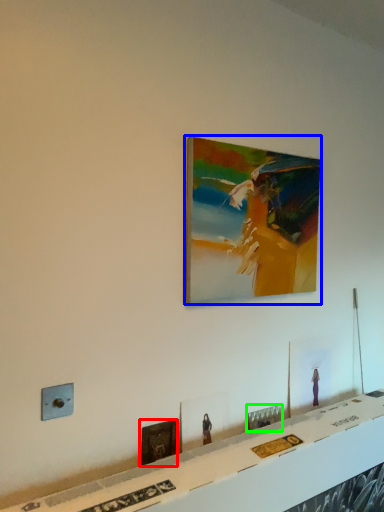
Question: Which object is the closest to the picture frame (highlighted by a red box)? Choose among these: picture frame (highlighted by a blue box) or picture frame (highlighted by a green box).

Choices:
 (A) picture frame
 (B) picture frame

Answer: (B)